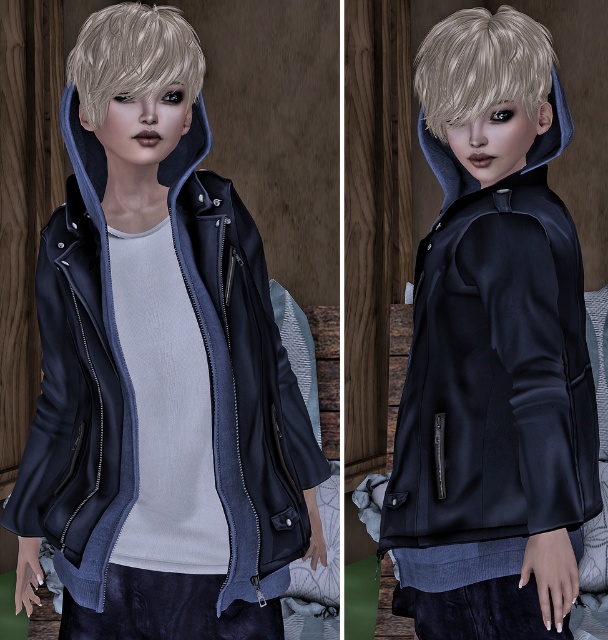
Is matte black jacket at center to the right of blondehair at upper center from the viewer's perspective?

No, matte black jacket at center is not to the right of blondehair at upper center.

Which is behind, point (229, 602) or point (457, 19)?

The point (457, 19) is behind.

Where is `matte black jacket at center`? matte black jacket at center is located at coordinates (157, 365).

Which of these two, blondehair at upper center or blondehair at center, stands taller?

Standing taller between the two is blondehair at upper center.

Describe the element at coordinates (482, 67) in the screenshot. I see `blondehair at upper center` at that location.

Image resolution: width=608 pixels, height=640 pixels. In order to click on blondehair at upper center in this screenshot , I will do `click(482, 67)`.

Does satin black jacket at center appear over matte blue hood at upper center?

Incorrect, satin black jacket at center is not positioned above matte blue hood at upper center.

Does satin black jacket at center appear on the right side of matte blue hood at upper center?

Incorrect, satin black jacket at center is not on the right side of matte blue hood at upper center.

This screenshot has height=640, width=608. Describe the element at coordinates (492, 349) in the screenshot. I see `satin black jacket at center` at that location.

Locate an element on the screen. satin black jacket at center is located at coordinates (492, 349).